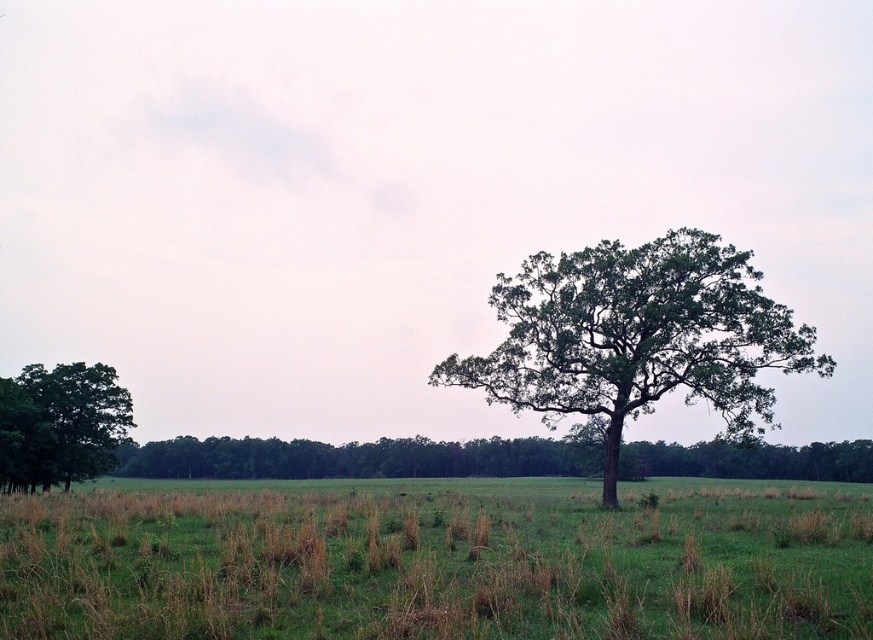
Question: Which object is farther from the camera taking this photo?

Choices:
 (A) green leafy oak tree at center
 (B) green leafy tree at left
 (C) green grass at center
 (D) green leafy tree at center

Answer: (B)

Question: Which of the following is the closest to the observer?

Choices:
 (A) (0, 468)
 (B) (679, 467)
 (C) (503, 593)

Answer: (C)

Question: Is green grass at center positioned behind green leafy tree at left?

Choices:
 (A) no
 (B) yes

Answer: (A)

Question: Is green grass at center positioned at the back of green leafy tree at center?

Choices:
 (A) yes
 (B) no

Answer: (B)

Question: Among these objects, which one is farthest from the camera?

Choices:
 (A) green grass at center
 (B) green leafy tree at left
 (C) green leafy tree at center

Answer: (B)

Question: Can you confirm if green leafy oak tree at center is wider than green leafy tree at left?

Choices:
 (A) yes
 (B) no

Answer: (A)